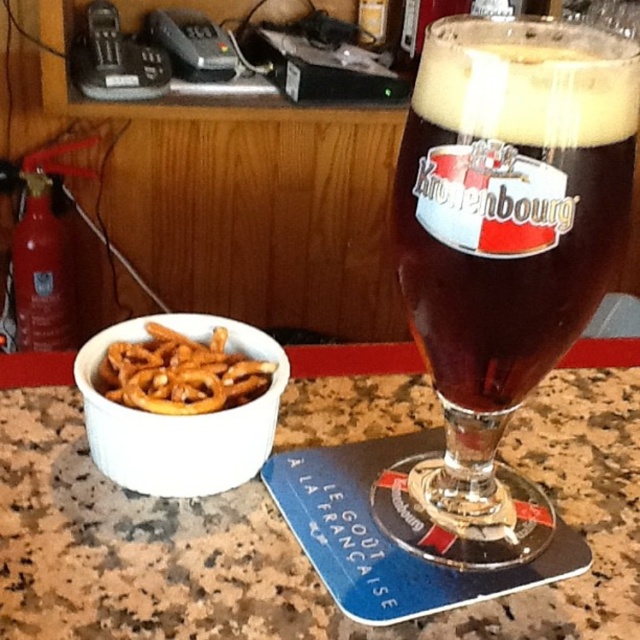
You are a bartender who needs to place a new menu on the counter between the white ceramic bowl at left and the golden crispy pretzels at lower left. Is there enough space between them to fit the menu?

The white ceramic bowl at left is to the left of golden crispy pretzels at lower left, so there is space between them to place the menu.

You are a customer at the bar and want to reach the golden crispy pretzels at lower left. Can you easily grab them without moving the granite countertop at center?

The granite countertop at center is much taller than the golden crispy pretzels at lower left, so you might need to bend down or adjust your position to reach them comfortably.